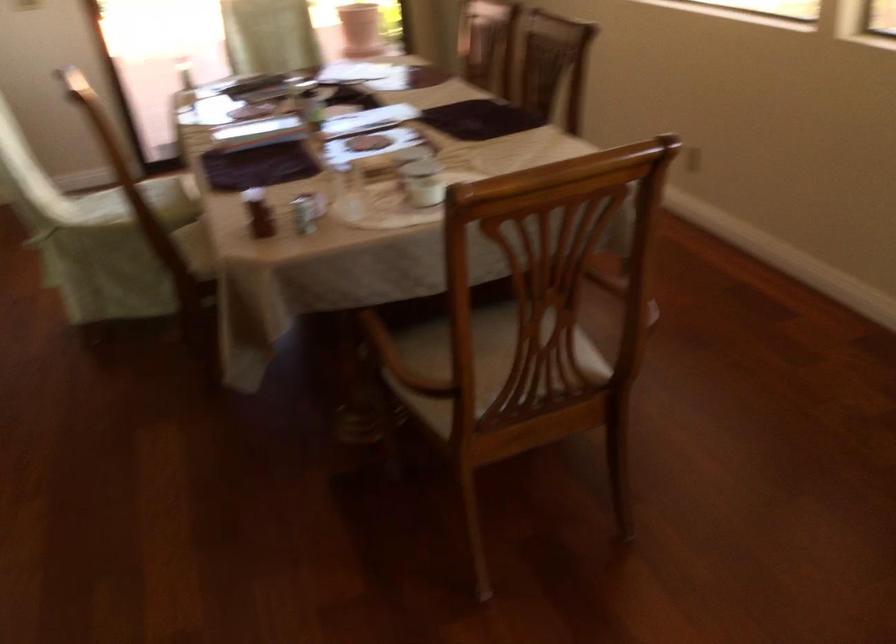
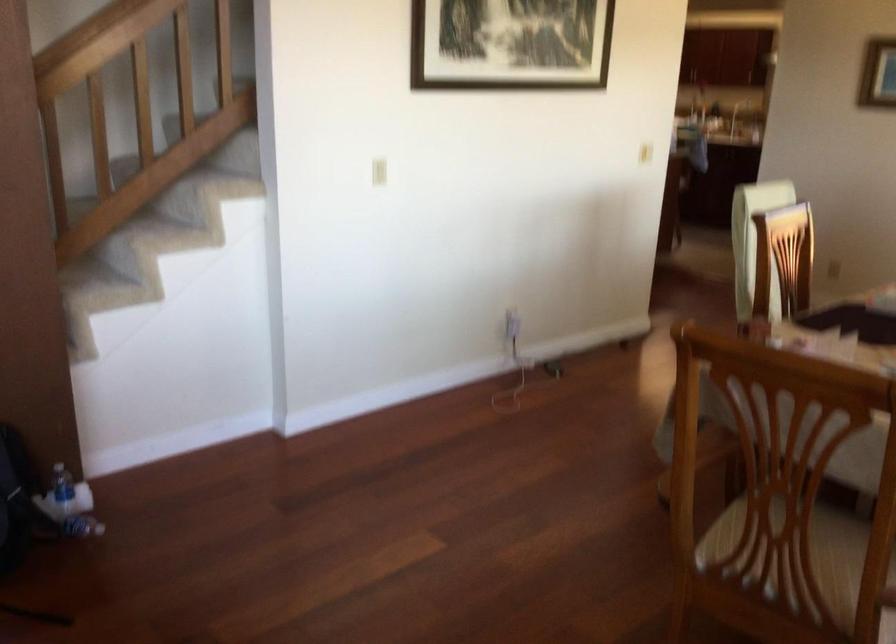
Find the pixel in the second image that matches [445,389] in the first image.

(736, 532)